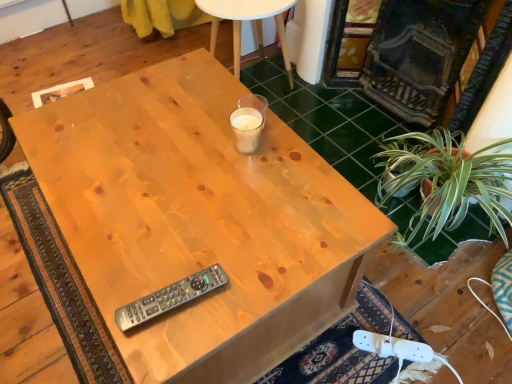
Identify the location of empty space that is in between gray plastic remote at center and white paper cup at center, the 2th coffee cup in the bottom-to-top sequence. (208, 210).